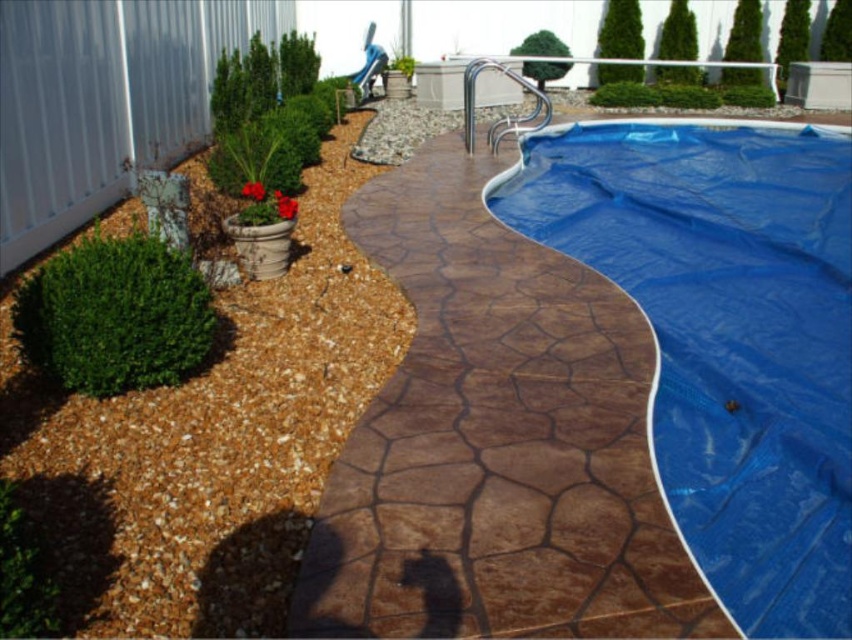
Is brown textured concrete at center thinner than brown gravel mulch at lower left?

Yes.

Does point (642, 356) come behind point (252, 602)?

That is True.

You are a GUI agent. You are given a task and a screenshot of the screen. Output one action in this format:
    pyautogui.click(x=<x>, y=<y>)
    Task: Click on the brown textured concrete at center
    The image size is (852, 640).
    Given the screenshot: What is the action you would take?
    pyautogui.click(x=494, y=442)

Looking at this image, does blue tarp at center have a lesser width compared to brown gravel mulch at lower left?

No, blue tarp at center is not thinner than brown gravel mulch at lower left.

Which is below, blue tarp at center or brown gravel mulch at lower left?

brown gravel mulch at lower left is below.

This screenshot has width=852, height=640. In order to click on blue tarp at center in this screenshot , I will do `click(726, 337)`.

Is the position of brown textured concrete at center less distant than that of blue tarp at center?

Yes, brown textured concrete at center is closer to the viewer.

In the scene shown: Does brown textured concrete at center have a lesser height compared to blue tarp at center?

Correct, brown textured concrete at center is not as tall as blue tarp at center.

Between point (571, 627) and point (528, 141), which one is positioned behind?

The point (528, 141) is more distant.

You are a GUI agent. You are given a task and a screenshot of the screen. Output one action in this format:
    pyautogui.click(x=<x>, y=<y>)
    Task: Click on the brown textured concrete at center
    
    Given the screenshot: What is the action you would take?
    pyautogui.click(x=494, y=442)